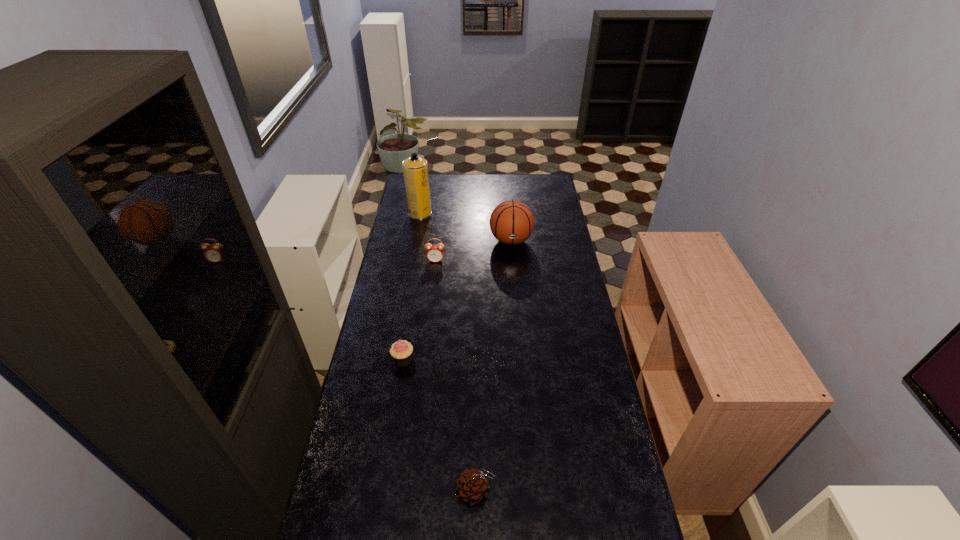
This screenshot has height=540, width=960. In order to click on free space located on the right of the cupcake in this screenshot , I will do `click(512, 360)`.

Locate an element on the screen. The image size is (960, 540). free space located with a leaf charm attached to the nearest object is located at coordinates (517, 491).

Locate an element on the screen. aerosol can located at the left edge is located at coordinates (415, 169).

The height and width of the screenshot is (540, 960). Find the location of `cupcake that is positioned at the left edge`. cupcake that is positioned at the left edge is located at coordinates (401, 351).

What are the coordinates of `vacant space at the far edge of the desktop` in the screenshot? It's located at (496, 180).

At what (x,y) coordinates should I click in order to perform the action: click on vacant space at the left edge. Please return your answer as a coordinate pair (x, y). Looking at the image, I should click on (417, 237).

Where is `free space at the right edge of the desktop`? Image resolution: width=960 pixels, height=540 pixels. free space at the right edge of the desktop is located at coordinates (x=576, y=449).

This screenshot has height=540, width=960. In the image, there is a desktop. Identify the location of vacant space at the far right corner. (533, 195).

At what (x,y) coordinates should I click in order to perform the action: click on free space between the second nearest object and the nearest object. Please return your answer as a coordinate pair (x, y). Looking at the image, I should click on (440, 426).

Identify the location of free spot between the nearest object and the tallest object. This screenshot has height=540, width=960. (448, 353).